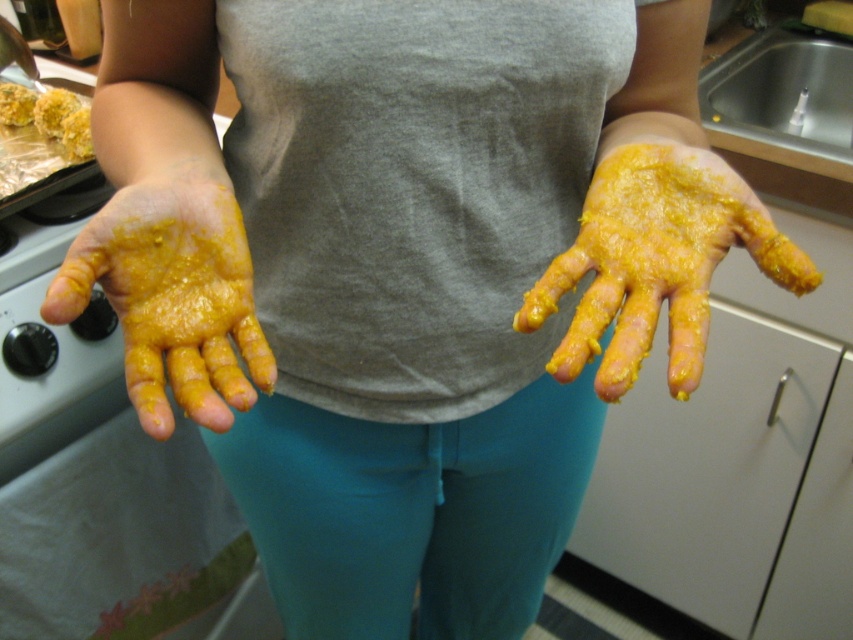
You are a chef holding a knife in your right hand. You need to reach the black knob on the stove to turn off the heat. Your knife is 8 inches long. The yellow matte hand at left is yours. Can you safely reach the black knob without dropping the knife?

The yellow matte hand at left is 15.84 inches away from the camera. Since the knife is only 8 inches long, you can safely reach the black knob on the stove without dropping the knife as the distance between your hand and the knob is within the knife length.

You are a chef observing the scene in the kitchen. You notice the yellow matte hand at center and the yellow crumbly food at left. Which object is closer to you?

The yellow matte hand at center is closer to you because it is in front of the yellow crumbly food at left.

You are a chef preparing a dish and notice two yellow items in your kitchen scene. One is the yellow matte hand at left and the other is the yellow crumbly food at upper left. Which of these two items is bigger in size?

The yellow matte hand at left is larger in size compared to the yellow crumbly food at upper left according to the description.